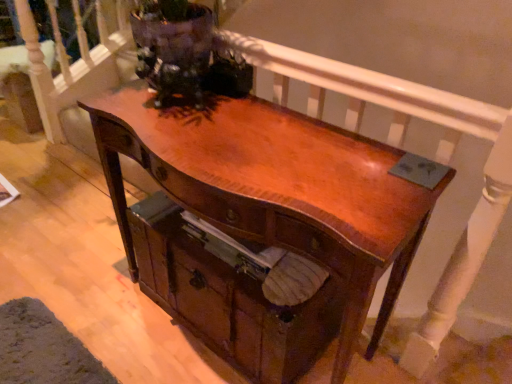
Measure the distance between point (405, 200) and camera.

The depth of point (405, 200) is 86.10 centimeters.

The image size is (512, 384). Identify the location of shiny brown wood desk at center. (276, 189).

The width and height of the screenshot is (512, 384). What do you see at coordinates (276, 189) in the screenshot? I see `shiny brown wood desk at center` at bounding box center [276, 189].

Describe the element at coordinates (234, 295) in the screenshot. The height and width of the screenshot is (384, 512). I see `wooden drawer at center` at that location.

Based on the photo, what is the approximate width of wooden drawer at center?

The width of wooden drawer at center is 16.73 inches.

Identify the location of wooden drawer at center. (234, 295).

The width and height of the screenshot is (512, 384). Find the location of `shiny brown wood desk at center`. shiny brown wood desk at center is located at coordinates (276, 189).

Which is more to the right, shiny brown wood desk at center or wooden drawer at center?

From the viewer's perspective, wooden drawer at center appears more on the right side.

Does shiny brown wood desk at center lie behind wooden drawer at center?

No, shiny brown wood desk at center is closer to the camera.

Is point (259, 130) closer to viewer compared to point (191, 236)?

Yes, it is.

From the image's perspective, is shiny brown wood desk at center under wooden drawer at center?

Actually, shiny brown wood desk at center appears above wooden drawer at center in the image.

From a real-world perspective, which is physically above, shiny brown wood desk at center or wooden drawer at center?

shiny brown wood desk at center, from a real-world perspective.

Does shiny brown wood desk at center have a lesser width compared to wooden drawer at center?

Yes, shiny brown wood desk at center is thinner than wooden drawer at center.

Considering the relative sizes of shiny brown wood desk at center and wooden drawer at center in the image provided, is shiny brown wood desk at center shorter than wooden drawer at center?

Incorrect, the height of shiny brown wood desk at center does not fall short of that of wooden drawer at center.

Which of these two, shiny brown wood desk at center or wooden drawer at center, is smaller?

wooden drawer at center.

Would you say wooden drawer at center is part of shiny brown wood desk at center's contents?

Yes, shiny brown wood desk at center is surrounding wooden drawer at center.

Is shiny brown wood desk at center far away from wooden drawer at center?

They are positioned close to each other.

Is shiny brown wood desk at center looking in the opposite direction of wooden drawer at center?

Yes, shiny brown wood desk at center is positioned with its back facing wooden drawer at center.

This screenshot has width=512, height=384. Find the location of `desk in front of the wooden drawer at center`. desk in front of the wooden drawer at center is located at coordinates (276, 189).

Considering the positions of objects wooden drawer at center and shiny brown wood desk at center in the image provided, who is more to the right, wooden drawer at center or shiny brown wood desk at center?

Positioned to the right is wooden drawer at center.

Which object is further away from the camera taking this photo, wooden drawer at center or shiny brown wood desk at center?

wooden drawer at center is more distant.

From the picture: Which point is more distant from viewer, [289,345] or [144,160]?

The point [289,345] is behind.

From the image's perspective, which one is positioned higher, wooden drawer at center or shiny brown wood desk at center?

shiny brown wood desk at center is shown above in the image.

From a real-world perspective, between wooden drawer at center and shiny brown wood desk at center, who is vertically lower?

wooden drawer at center is physically lower.

Between wooden drawer at center and shiny brown wood desk at center, which one has larger width?

Wider between the two is wooden drawer at center.

Considering the relative sizes of wooden drawer at center and shiny brown wood desk at center in the image provided, is wooden drawer at center shorter than shiny brown wood desk at center?

Correct, wooden drawer at center is not as tall as shiny brown wood desk at center.

Who is bigger, wooden drawer at center or shiny brown wood desk at center?

shiny brown wood desk at center is bigger.

Is wooden drawer at center located outside shiny brown wood desk at center?

Actually, wooden drawer at center is at least partially inside shiny brown wood desk at center.

Is wooden drawer at center next to shiny brown wood desk at center?

No, wooden drawer at center is not with shiny brown wood desk at center.

Is wooden drawer at center turned away from shiny brown wood desk at center?

That's right, wooden drawer at center is facing away from shiny brown wood desk at center.

Locate an element on the screen. The height and width of the screenshot is (384, 512). desk on the left of the wooden drawer at center is located at coordinates (276, 189).

Image resolution: width=512 pixels, height=384 pixels. In order to click on desk in front of the wooden drawer at center in this screenshot , I will do `click(276, 189)`.

Locate an element on the screen. drawer located behind the shiny brown wood desk at center is located at coordinates (234, 295).